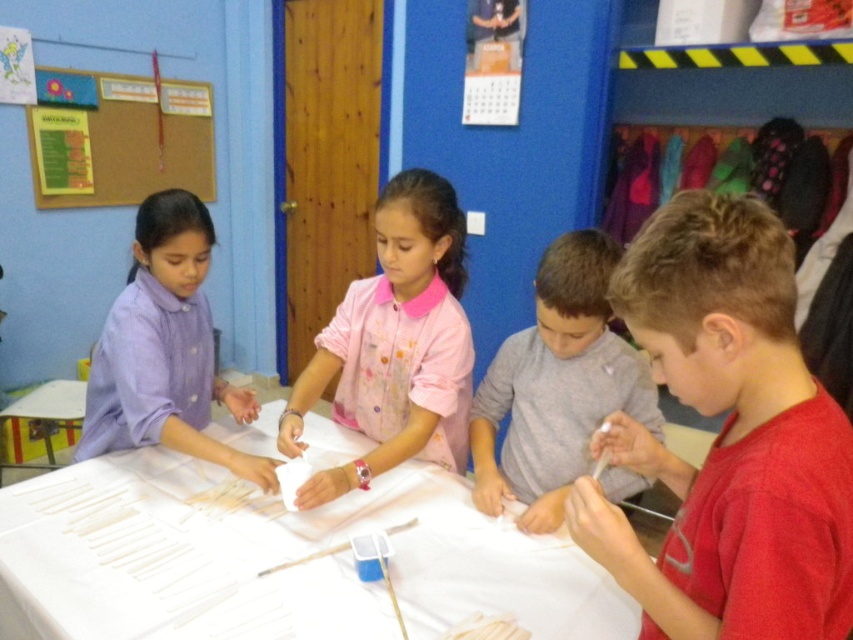
Is white paper at center thinner than purple cotton shirt at left?

Incorrect, white paper at center's width is not less than purple cotton shirt at left's.

Is point (204, 552) less distant than point (141, 381)?

Yes, it is.

The image size is (853, 640). I want to click on white paper at center, so click(274, 560).

Who is positioned more to the left, white paper at center or pink fabric shirt at center?

white paper at center

Can you confirm if white paper at center is positioned below pink fabric shirt at center?

Indeed, white paper at center is positioned under pink fabric shirt at center.

This screenshot has width=853, height=640. In order to click on white paper at center in this screenshot , I will do `click(274, 560)`.

Is purple cotton shirt at left behind burlap bulletin board at upper left?

No, purple cotton shirt at left is in front of burlap bulletin board at upper left.

Who is positioned more to the right, purple cotton shirt at left or burlap bulletin board at upper left?

purple cotton shirt at left is more to the right.

Between point (175, 225) and point (137, 154), which one is positioned behind?

The point (137, 154) is more distant.

I want to click on purple cotton shirt at left, so click(165, 348).